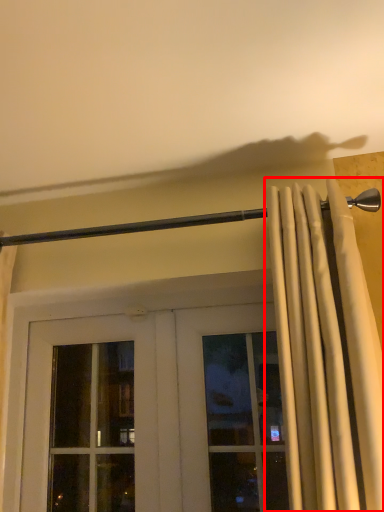
Question: Observing the image, what is the correct spatial positioning of curtain (annotated by the red box) in reference to beam?

Choices:
 (A) left
 (B) right

Answer: (B)